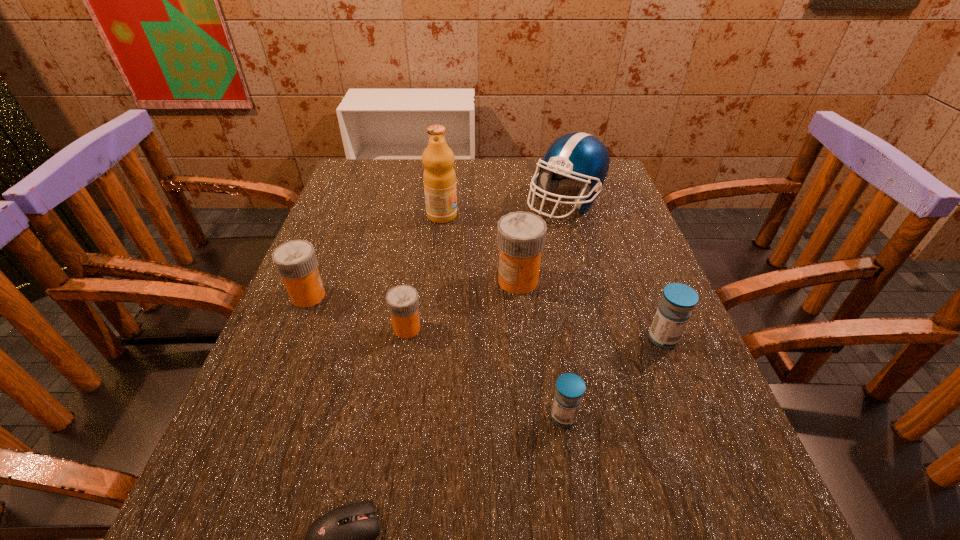
Image resolution: width=960 pixels, height=540 pixels. In the image, there is a desktop. In order to click on vacant space at the near left corner in this screenshot , I will do `click(229, 507)`.

This screenshot has width=960, height=540. I want to click on free spot at the near right corner of the desktop, so click(651, 498).

Locate an element on the screen. free space between the nearest medicine and the tallest medicine is located at coordinates (540, 349).

You are a GUI agent. You are given a task and a screenshot of the screen. Output one action in this format:
    pyautogui.click(x=<x>, y=<y>)
    Task: Click on the free space between the right blue medicine and the football helmet
    The height and width of the screenshot is (540, 960).
    Given the screenshot: What is the action you would take?
    pyautogui.click(x=614, y=271)

I want to click on free area in between the nearest medicine and the second biggest orange medicine, so click(x=436, y=356).

What are the coordinates of `vacant space that is in between the fourth medicine from right to left and the second tallest object` in the screenshot? It's located at (487, 265).

Locate an element on the screen. vacant space in between the nearest medicine and the football helmet is located at coordinates (564, 309).

The height and width of the screenshot is (540, 960). I want to click on object that is the third closest to the biggest orange medicine, so click(x=439, y=178).

The width and height of the screenshot is (960, 540). What are the coordinates of `object that is the closest to the tallest medicine` in the screenshot? It's located at (578, 159).

This screenshot has height=540, width=960. I want to click on the fourth closest medicine to the right blue medicine, so click(296, 262).